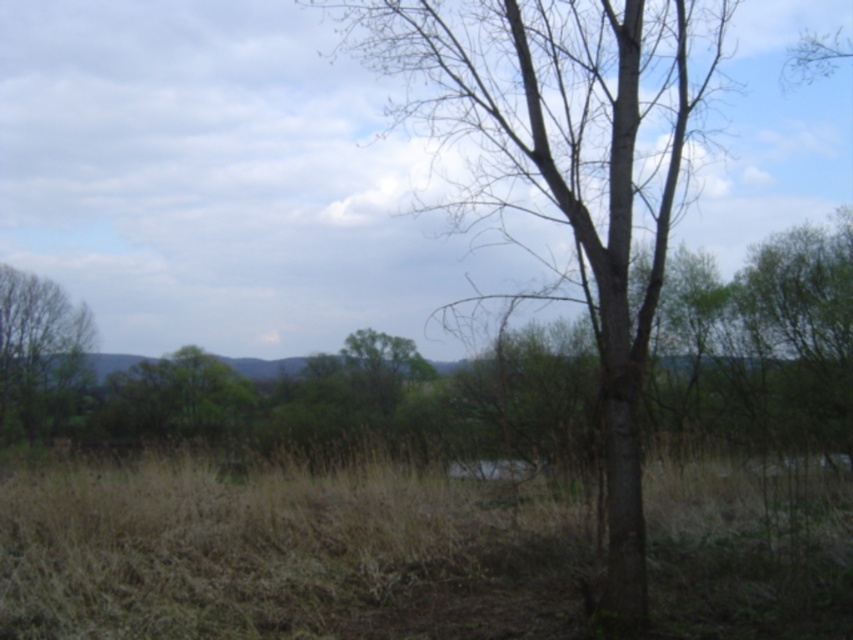
Is brown dry grass at center shorter than green leafy tree at left?

Correct, brown dry grass at center is not as tall as green leafy tree at left.

This screenshot has height=640, width=853. I want to click on brown dry grass at center, so click(286, 556).

Image resolution: width=853 pixels, height=640 pixels. What do you see at coordinates (286, 556) in the screenshot?
I see `brown dry grass at center` at bounding box center [286, 556].

Find the location of a particular element. The image size is (853, 640). brown dry grass at center is located at coordinates (286, 556).

Which is behind, point (576, 522) or point (677, 44)?

Positioned behind is point (576, 522).

Between brown dry grass at center and smooth bark tree at center, which one appears on the right side from the viewer's perspective?

smooth bark tree at center is more to the right.

You are a GUI agent. You are given a task and a screenshot of the screen. Output one action in this format:
    pyautogui.click(x=<x>, y=<y>)
    Task: Click on the brown dry grass at center
    The height and width of the screenshot is (640, 853).
    Given the screenshot: What is the action you would take?
    pyautogui.click(x=286, y=556)

Does smooth bark tree at center have a larger size compared to green leafy tree at left?

Yes.

Can you confirm if smooth bark tree at center is positioned to the left of green leafy tree at left?

No, smooth bark tree at center is not to the left of green leafy tree at left.

Describe the element at coordinates (563, 168) in the screenshot. I see `smooth bark tree at center` at that location.

You are a GUI agent. You are given a task and a screenshot of the screen. Output one action in this format:
    pyautogui.click(x=<x>, y=<y>)
    Task: Click on the smooth bark tree at center
    This screenshot has height=640, width=853.
    Given the screenshot: What is the action you would take?
    pyautogui.click(x=563, y=168)